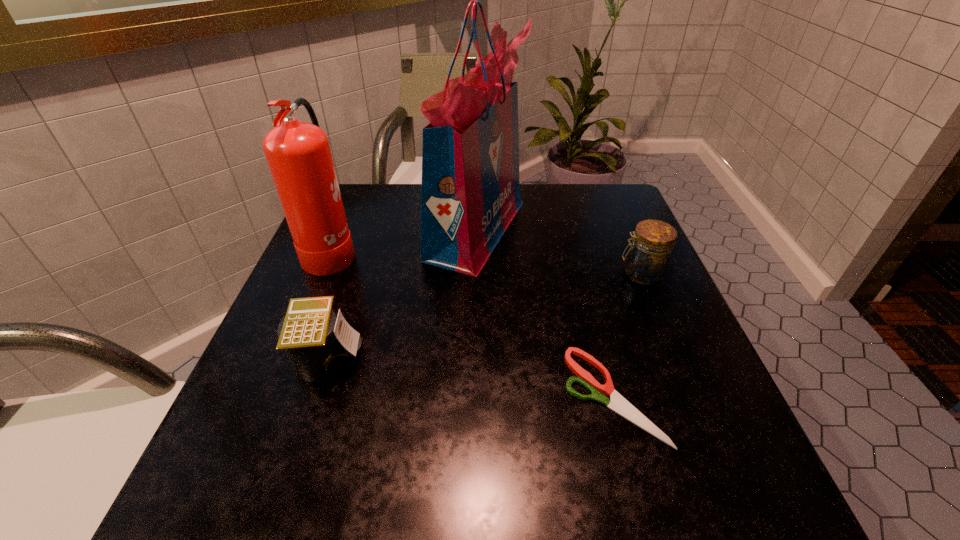
Where is `vacant space located 0.350m on the lid of the rightmost object`? The width and height of the screenshot is (960, 540). vacant space located 0.350m on the lid of the rightmost object is located at coordinates (459, 274).

Find the location of `vacant space situated 0.400m on the lid of the rightmost object`. vacant space situated 0.400m on the lid of the rightmost object is located at coordinates tap(436, 274).

Where is `vacant space located on the lid of the rightmost object`? The image size is (960, 540). vacant space located on the lid of the rightmost object is located at coordinates (500, 274).

Locate an element on the screen. vacant space located on the front of the calculator is located at coordinates (294, 468).

This screenshot has height=540, width=960. I want to click on vacant space located on the back of the scissors, so click(x=570, y=235).

This screenshot has height=540, width=960. In order to click on grocery bag that is at the far edge in this screenshot , I will do click(x=470, y=193).

This screenshot has height=540, width=960. Find the location of `fire extinguisher at the far edge`. fire extinguisher at the far edge is located at coordinates (299, 157).

Locate an element on the screen. fire extinguisher that is at the left edge is located at coordinates (299, 157).

I want to click on calculator that is positioned at the left edge, so click(x=319, y=345).

Locate an element on the screen. The height and width of the screenshot is (540, 960). jar located at the right edge is located at coordinates (647, 260).